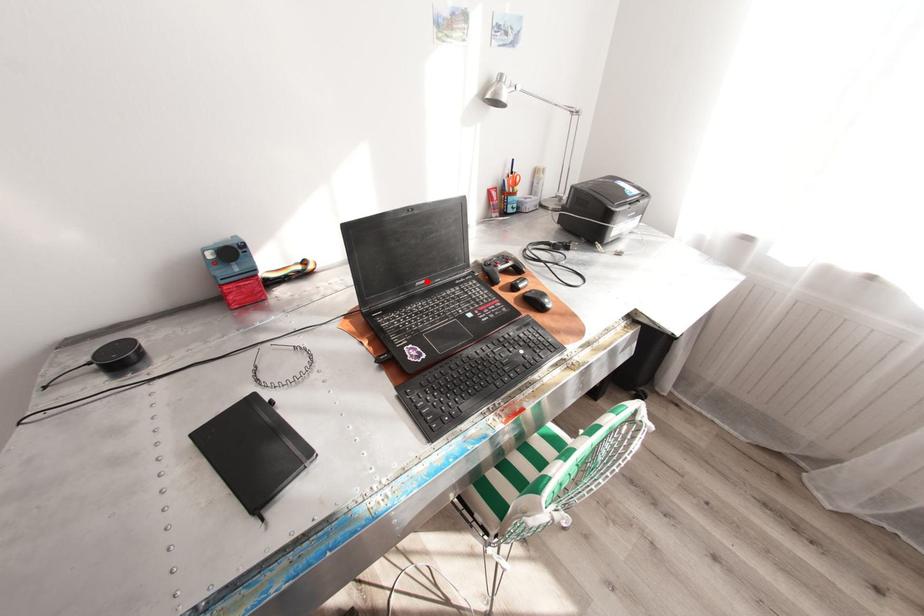
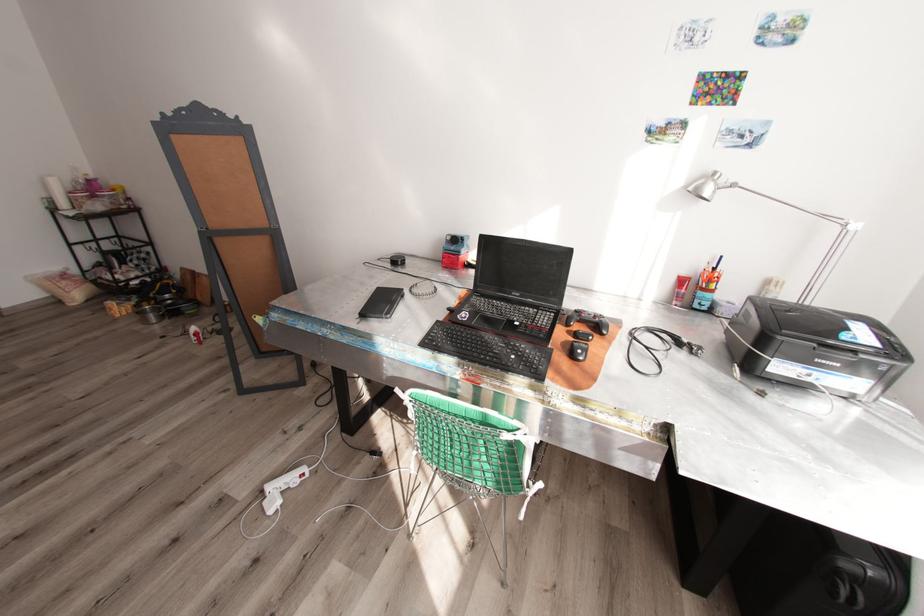
Locate, in the second image, the point that corresponds to the highlighted location in the first image.

(523, 294)